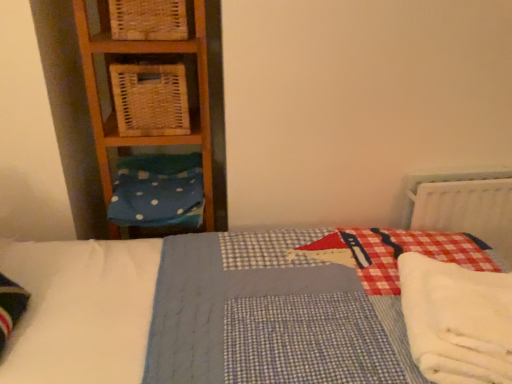
Question: Is white fluffy blanket at lower right inside woven wood crate at upper left, acting as the 1th crate starting from the top?

Choices:
 (A) no
 (B) yes

Answer: (A)

Question: Is woven wood crate at upper left, arranged as the 2th crate when ordered from the bottom, further to camera compared to white fluffy blanket at lower right?

Choices:
 (A) no
 (B) yes

Answer: (B)

Question: Considering the relative sizes of woven wood crate at upper left, acting as the 1th crate starting from the top, and white fluffy blanket at lower right in the image provided, is woven wood crate at upper left, acting as the 1th crate starting from the top, shorter than white fluffy blanket at lower right?

Choices:
 (A) yes
 (B) no

Answer: (B)

Question: Considering the relative sizes of woven wood crate at upper left, acting as the 1th crate starting from the top, and white fluffy blanket at lower right in the image provided, is woven wood crate at upper left, acting as the 1th crate starting from the top, taller than white fluffy blanket at lower right?

Choices:
 (A) yes
 (B) no

Answer: (A)

Question: Is woven wood crate at upper left, acting as the 1th crate starting from the top, wider than white fluffy blanket at lower right?

Choices:
 (A) no
 (B) yes

Answer: (A)

Question: Are woven wood crate at upper left, arranged as the 2th crate when ordered from the bottom, and white fluffy blanket at lower right located far from each other?

Choices:
 (A) yes
 (B) no

Answer: (A)

Question: Does woven wood basket at left, the 1th crate in the bottom-to-top sequence, have a greater width compared to white fluffy blanket at lower right?

Choices:
 (A) yes
 (B) no

Answer: (B)

Question: Considering the relative sizes of woven wood basket at left, the 1th crate in the bottom-to-top sequence, and white fluffy blanket at lower right in the image provided, is woven wood basket at left, the 1th crate in the bottom-to-top sequence, thinner than white fluffy blanket at lower right?

Choices:
 (A) yes
 (B) no

Answer: (A)

Question: Is woven wood basket at left, the 1th crate in the bottom-to-top sequence, bigger than white fluffy blanket at lower right?

Choices:
 (A) yes
 (B) no

Answer: (A)

Question: From the image's perspective, is woven wood basket at left, the 1th crate in the bottom-to-top sequence, located above white fluffy blanket at lower right?

Choices:
 (A) no
 (B) yes

Answer: (B)

Question: Is woven wood basket at left, the second crate in the top-to-bottom sequence, smaller than white fluffy blanket at lower right?

Choices:
 (A) no
 (B) yes

Answer: (A)

Question: Is white fluffy blanket at lower right inside woven wood basket at left, the second crate in the top-to-bottom sequence?

Choices:
 (A) no
 (B) yes

Answer: (A)

Question: Is blue polka dot fabric at left oriented towards woven wood basket at left, the second crate in the top-to-bottom sequence?

Choices:
 (A) yes
 (B) no

Answer: (B)